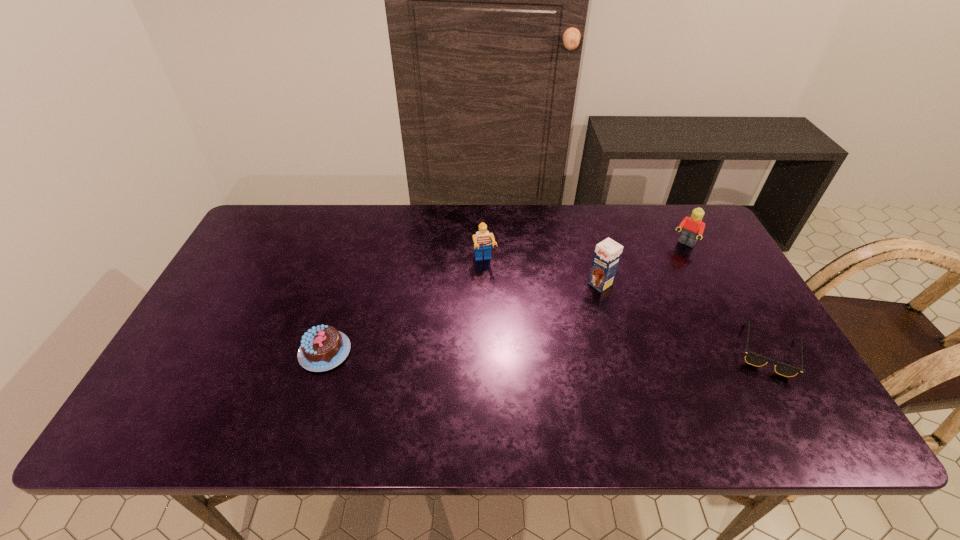
Where is `chocolate cake that is at the near edge`? This screenshot has height=540, width=960. chocolate cake that is at the near edge is located at coordinates (322, 348).

Locate an element on the screen. The width and height of the screenshot is (960, 540). sunglasses that is positioned at the near edge is located at coordinates (752, 358).

Where is `sunglasses located at the right edge`? Image resolution: width=960 pixels, height=540 pixels. sunglasses located at the right edge is located at coordinates (752, 358).

Where is `Lego located in the right edge section of the desktop`? Lego located in the right edge section of the desktop is located at coordinates (693, 226).

Locate an element on the screen. object present at the far right corner is located at coordinates (693, 226).

Where is `object located in the near right corner section of the desktop`? The width and height of the screenshot is (960, 540). object located in the near right corner section of the desktop is located at coordinates (752, 358).

Find the location of `vacant area at the far edge`. vacant area at the far edge is located at coordinates (611, 207).

In the image, there is a desktop. Find the location of `vacant space at the left edge`. vacant space at the left edge is located at coordinates (238, 259).

Locate an element on the screen. free spot at the far left corner of the desktop is located at coordinates [x=256, y=244].

The image size is (960, 540). I want to click on free space at the far right corner, so click(x=670, y=249).